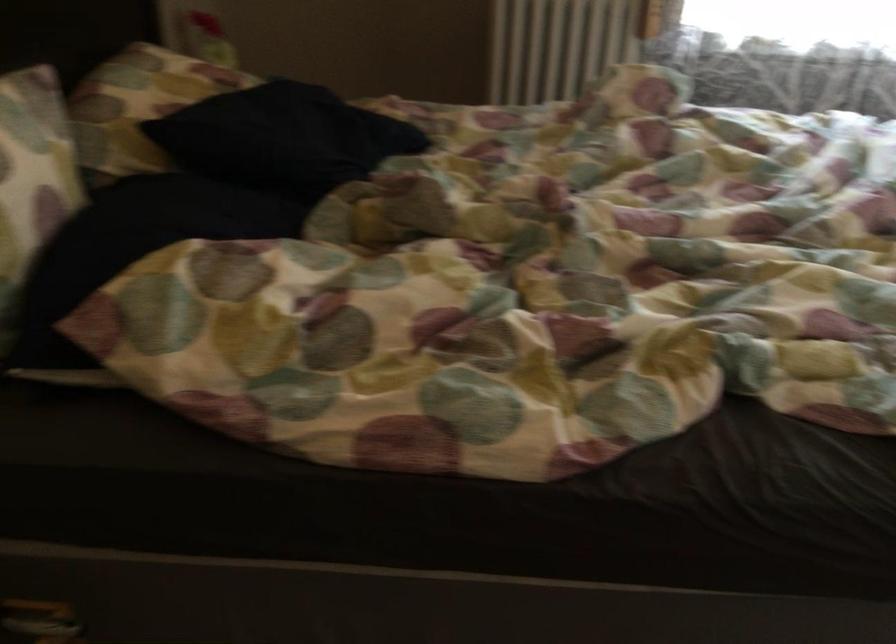
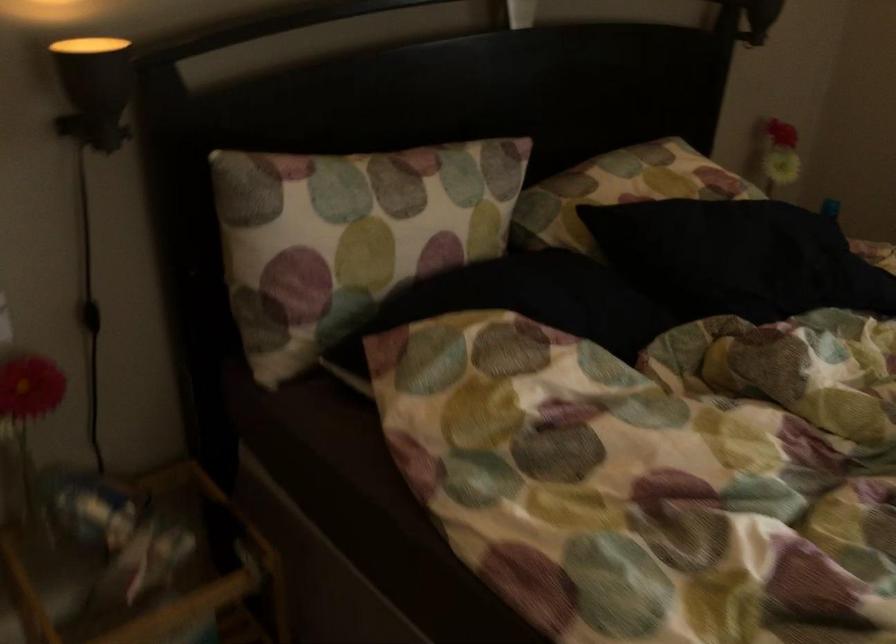
Where in the second image is the point corresponding to [317,136] from the first image?

(737, 258)